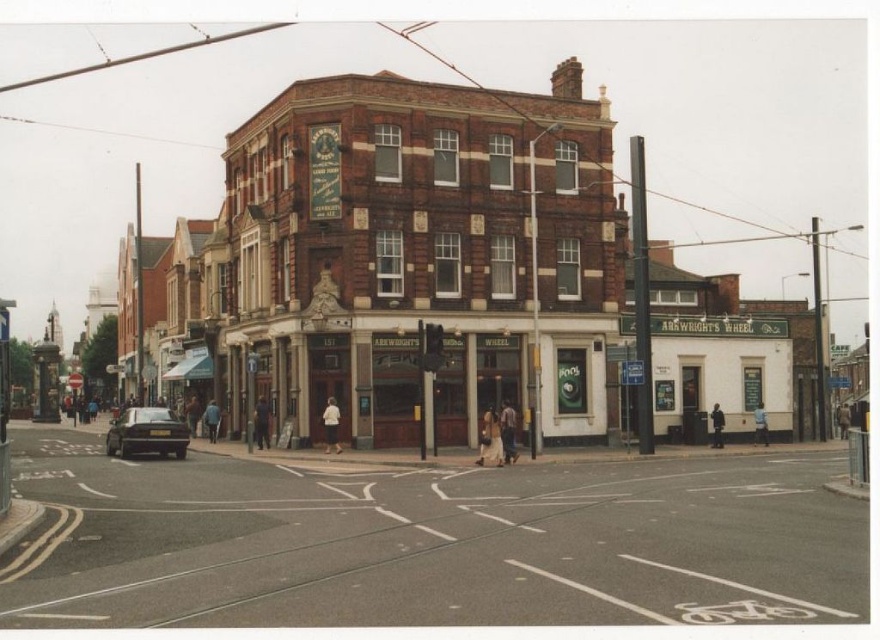
Does smooth asphalt road at center have a smaller size compared to light blue shirt at center?

Actually, smooth asphalt road at center might be larger than light blue shirt at center.

Who is lower down, smooth asphalt road at center or light blue shirt at center?

smooth asphalt road at center is lower down.

Is point (312, 541) farther from camera compared to point (761, 432)?

That is False.

Where is `smooth asphalt road at center`? The image size is (880, 640). smooth asphalt road at center is located at coordinates pos(431,541).

Which is below, light brown fabric dress at center or dark blue jeans at center?

light brown fabric dress at center

Is point (493, 413) more distant than point (268, 424)?

No, it is in front of (268, 424).

Is point (490, 452) farther from viewer compared to point (260, 429)?

No, it is in front of (260, 429).

This screenshot has height=640, width=880. Find the location of `light brown fabric dress at center`. light brown fabric dress at center is located at coordinates (489, 438).

The width and height of the screenshot is (880, 640). What do you see at coordinates (760, 424) in the screenshot? I see `light blue shirt at center` at bounding box center [760, 424].

Identify the location of light blue shirt at center. This screenshot has width=880, height=640. (760, 424).